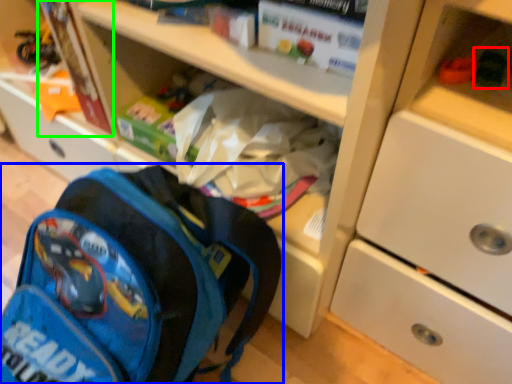
Question: Based on their relative distances, which object is nearer to toy (highlighted by a red box)? Choose from backpack (highlighted by a blue box) and paperback book (highlighted by a green box).

Choices:
 (A) backpack
 (B) paperback book

Answer: (A)